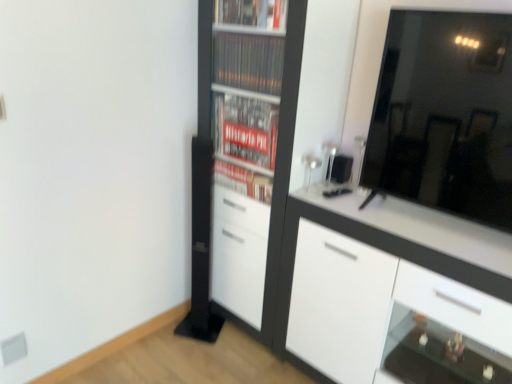
Question: Can you confirm if white glossy cabinet at right is shorter than transparent glass shelf at lower right?

Choices:
 (A) yes
 (B) no

Answer: (B)

Question: Could you tell me if white glossy cabinet at right is turned towards transparent glass shelf at lower right?

Choices:
 (A) yes
 (B) no

Answer: (A)

Question: From a real-world perspective, is white glossy cabinet at right positioned under transparent glass shelf at lower right based on gravity?

Choices:
 (A) yes
 (B) no

Answer: (B)

Question: Does white glossy cabinet at right have a greater height compared to transparent glass shelf at lower right?

Choices:
 (A) no
 (B) yes

Answer: (B)

Question: Is white glossy cabinet at right touching transparent glass shelf at lower right?

Choices:
 (A) yes
 (B) no

Answer: (B)

Question: Is transparent glass shelf at lower right completely or partially inside white glossy cabinet at right?

Choices:
 (A) no
 (B) yes

Answer: (B)

Question: Is transparent glass shelf at lower right oriented away from black glossy mirror at upper right?

Choices:
 (A) yes
 (B) no

Answer: (B)

Question: Is transparent glass shelf at lower right with black glossy mirror at upper right?

Choices:
 (A) no
 (B) yes

Answer: (A)

Question: Is there a large distance between transparent glass shelf at lower right and black glossy mirror at upper right?

Choices:
 (A) yes
 (B) no

Answer: (B)

Question: Is black glossy mirror at upper right located within transparent glass shelf at lower right?

Choices:
 (A) yes
 (B) no

Answer: (B)

Question: Is transparent glass shelf at lower right not inside black glossy mirror at upper right?

Choices:
 (A) yes
 (B) no

Answer: (A)

Question: Considering the relative sizes of transparent glass shelf at lower right and black glossy mirror at upper right in the image provided, is transparent glass shelf at lower right smaller than black glossy mirror at upper right?

Choices:
 (A) yes
 (B) no

Answer: (A)

Question: Can white matte cupboard at center be found inside black glossy mirror at upper right?

Choices:
 (A) no
 (B) yes

Answer: (A)